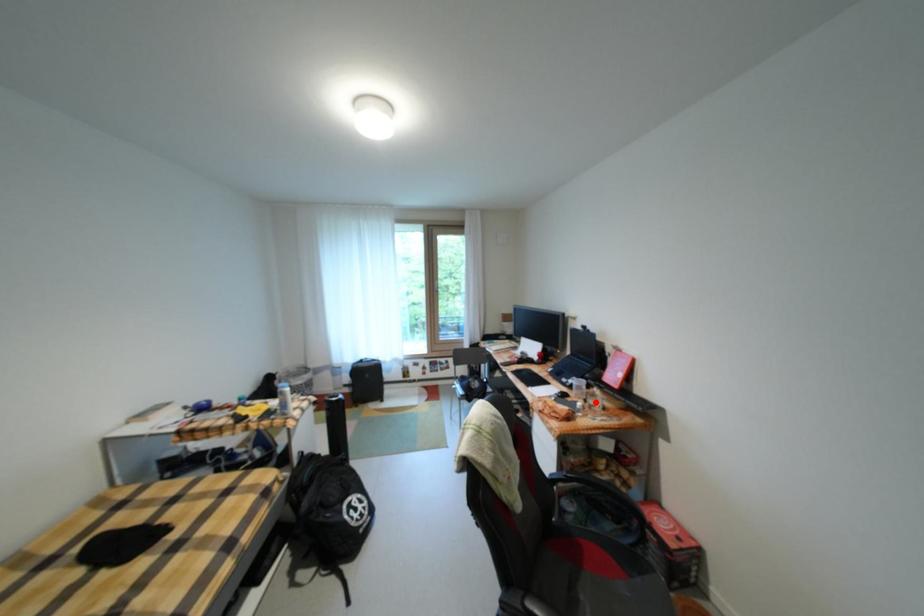
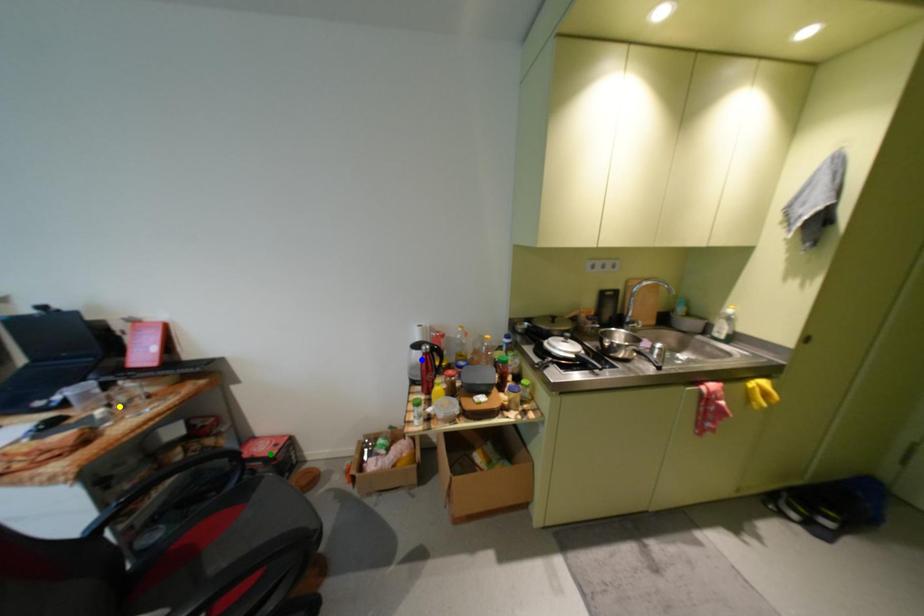
Question: I am providing you with two images of the same scene from different viewpoints. A red point is marked on the first image. You are given multiple points on the second image. Which spot in image 2 lines up with the point in image 1?

Choices:
 (A) yellow point
 (B) blue point
 (C) green point

Answer: (A)